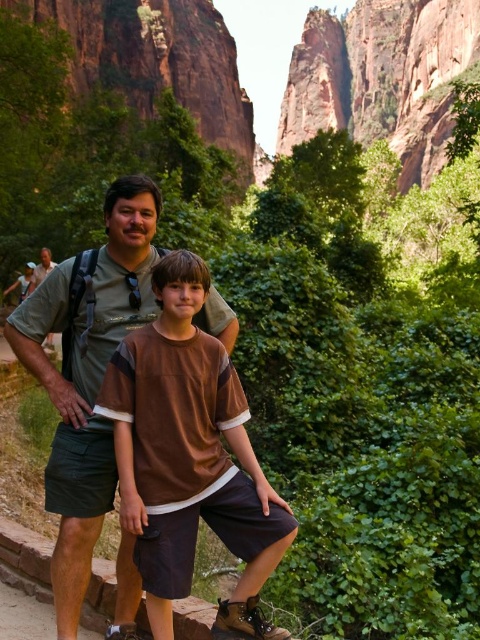
Question: Among these points, which one is nearest to the camera?

Choices:
 (A) (154, 600)
 (B) (59, 509)

Answer: (A)

Question: Is brown cotton shirt at center positioned at the back of green fabric shirt at center?

Choices:
 (A) no
 (B) yes

Answer: (A)

Question: Which of the following is the closest to the observer?

Choices:
 (A) brown cotton shirt at center
 (B) green fabric shirt at center

Answer: (A)

Question: Does brown cotton shirt at center come in front of green fabric shirt at center?

Choices:
 (A) no
 (B) yes

Answer: (B)

Question: Considering the relative positions of brown cotton shirt at center and green fabric shirt at center in the image provided, where is brown cotton shirt at center located with respect to green fabric shirt at center?

Choices:
 (A) left
 (B) right

Answer: (B)